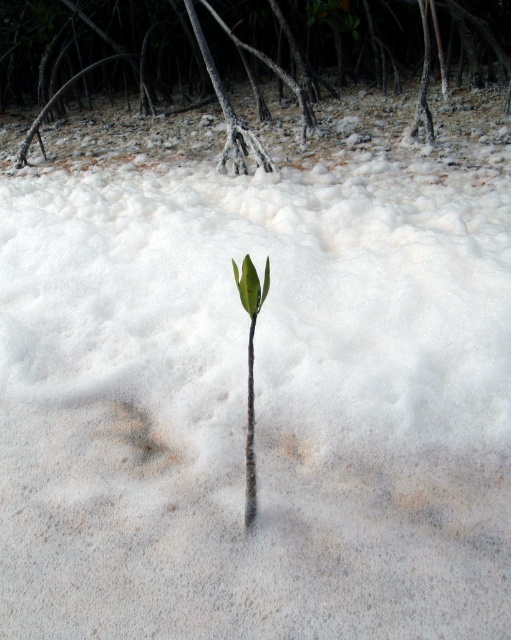
You are standing in a coastal area and see the brown rough mangrove root at center and the green matte leaf at center. Which object is positioned to the left of the other?

The brown rough mangrove root at center is positioned to the left of the green matte leaf at center.

From the picture: You are a botanist examining the image. You notice the brown rough mangrove root at center and the green matte leaf at center. Based on their positions, which object is closer to the observer?

The brown rough mangrove root at center is located above the green matte leaf at center, so it is closer to the observer.

You are a botanist studying coastal ecosystems. You observe the brown rough mangrove root at center and the green matte leaf at center in the image. Which of these two objects is taller?

The brown rough mangrove root at center is taller than the green matte leaf at center.